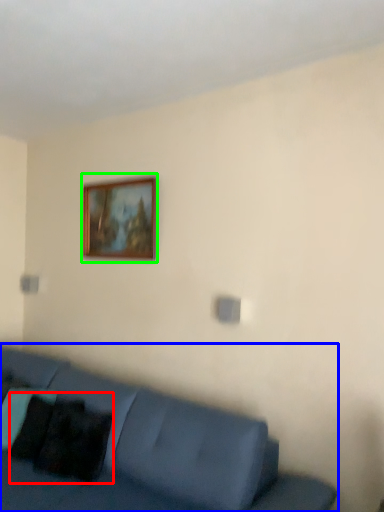
Question: Which is farther away from pillow (highlighted by a red box)? studio couch (highlighted by a blue box) or picture frame (highlighted by a green box)?

Choices:
 (A) studio couch
 (B) picture frame

Answer: (B)